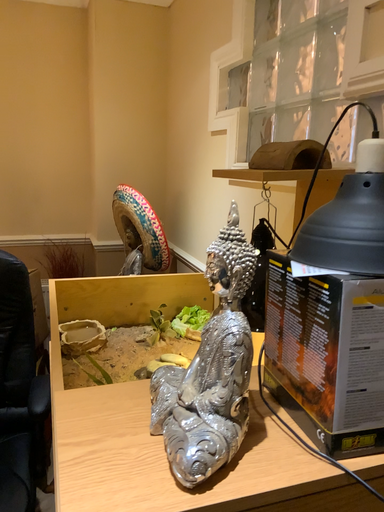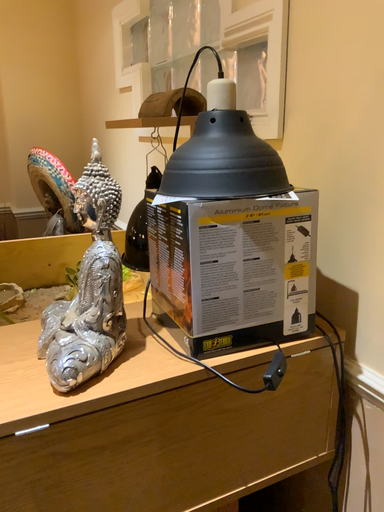
Question: Which way did the camera rotate in the video?

Choices:
 (A) rotated right
 (B) rotated left

Answer: (A)